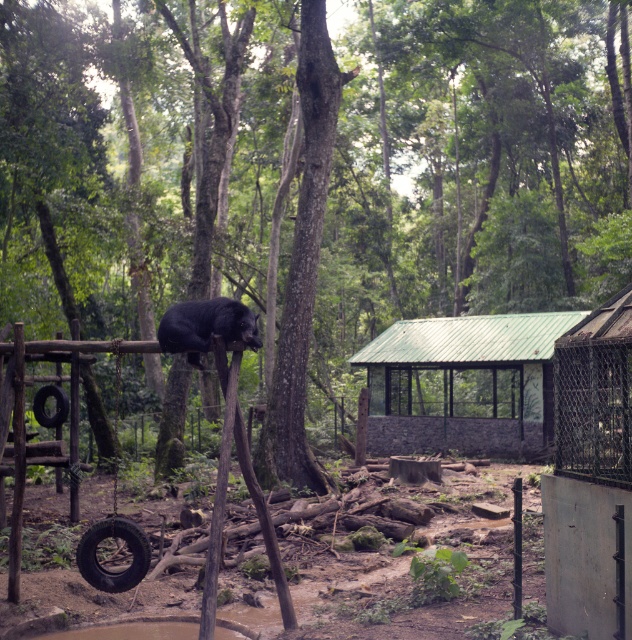
Question: Which of the following is the farthest from the observer?

Choices:
 (A) (59, 408)
 (B) (214, 324)
 (C) (454, 332)

Answer: (C)

Question: Which of the following is the farthest from the observer?

Choices:
 (A) (616, 422)
 (B) (118, 516)
 (C) (90, 548)
 (D) (289, 410)

Answer: (D)

Question: Is green corrugated metal hut at center to the left of black rubber tire at lower left from the viewer's perspective?

Choices:
 (A) yes
 (B) no

Answer: (B)

Question: Which point is closer to the camera taking this photo?

Choices:
 (A) (56, 401)
 (B) (167, 321)

Answer: (B)

Question: Can you confirm if rough bark tree at center is positioned above black rubber tire at lower left?

Choices:
 (A) yes
 (B) no

Answer: (A)

Question: Can you confirm if black fur bear at center is positioned above black rubber tire swing at lower left?

Choices:
 (A) no
 (B) yes

Answer: (B)